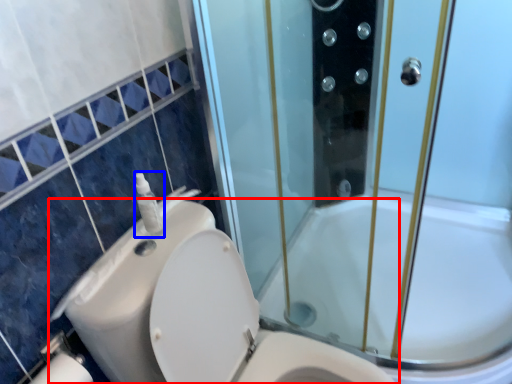
Question: Which object is further to the camera taking this photo, toilet (highlighted by a red box) or soap dispenser (highlighted by a blue box)?

Choices:
 (A) toilet
 (B) soap dispenser

Answer: (B)